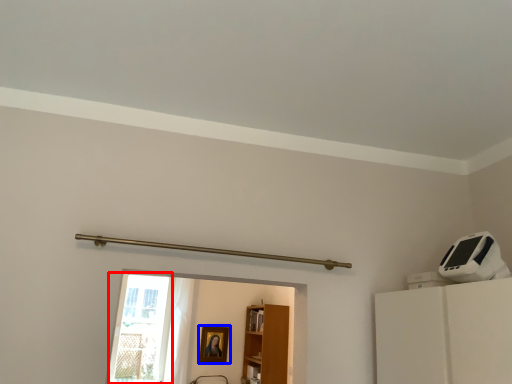
Question: Which point is further to the camera, glass door (highlighted by a red box) or picture frame (highlighted by a blue box)?

Choices:
 (A) glass door
 (B) picture frame

Answer: (B)